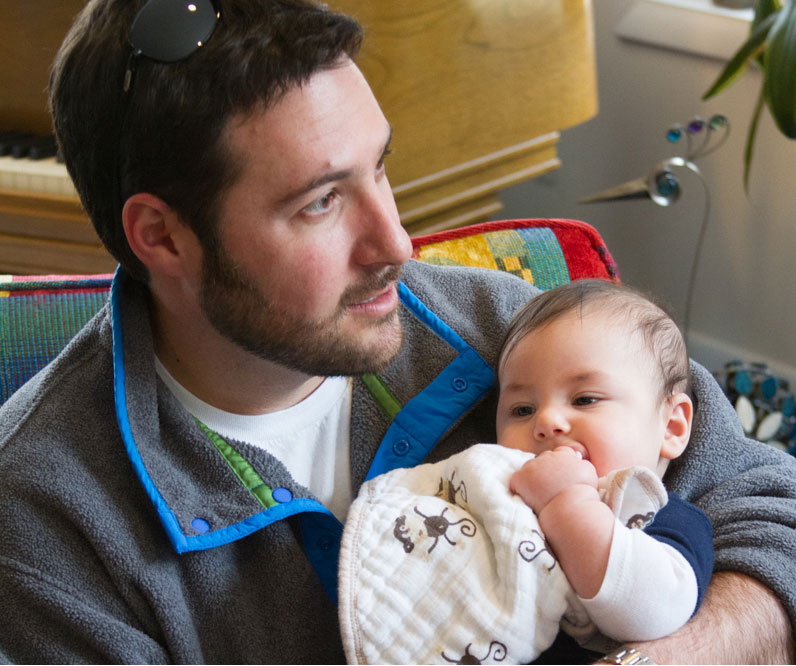
The width and height of the screenshot is (796, 666). I want to click on white blanket, so click(x=474, y=625).